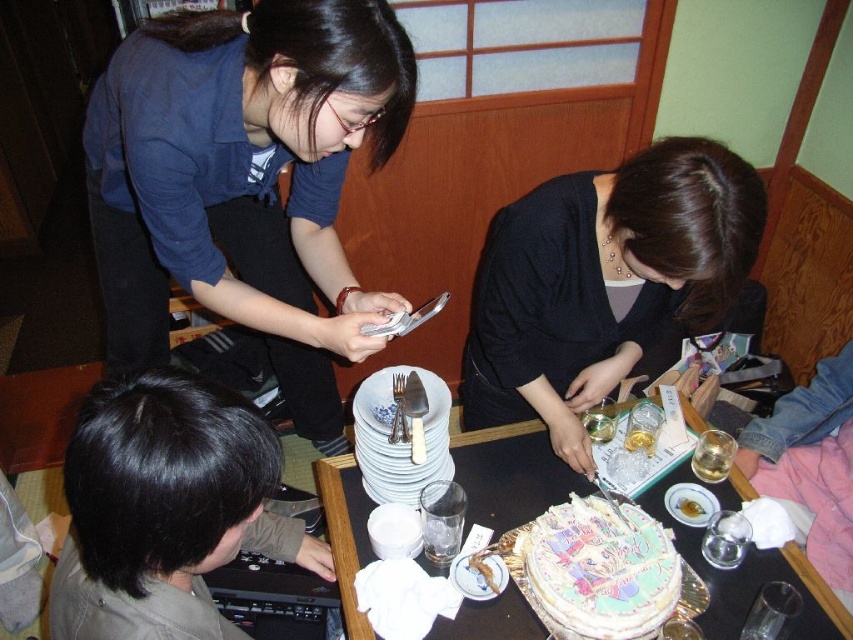
Question: Is brown matte hair at lower left smaller than white ceramic plate at center?

Choices:
 (A) yes
 (B) no

Answer: (B)

Question: Which of the following is the farthest from the observer?

Choices:
 (A) white ceramic plate at center
 (B) matte blue shirt at upper left
 (C) matte black sweater at center
 (D) decorative paper cake at center

Answer: (A)

Question: Where is brown matte hair at lower left located in relation to translucent glass at lower right in the image?

Choices:
 (A) below
 (B) above

Answer: (B)

Question: Can you confirm if white frosted cake at center is thinner than translucent glass at lower right?

Choices:
 (A) yes
 (B) no

Answer: (B)

Question: Which is farther from the decorative paper cake at center?

Choices:
 (A) brown matte hair at lower left
 (B) translucent glass at lower right
 (C) matte blue shirt at upper left

Answer: (C)

Question: Which object is closer to the camera taking this photo?

Choices:
 (A) decorative paper cake at center
 (B) white paper plate at center
 (C) white ceramic plate at center

Answer: (A)